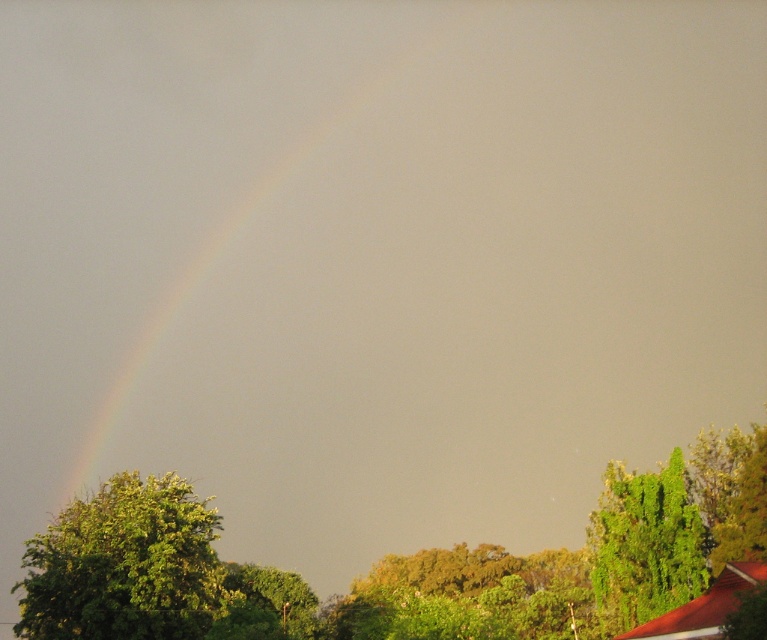
Question: Observing the image, what is the correct spatial positioning of rainbow at upper left in reference to green leafy tree at lower left?

Choices:
 (A) above
 (B) below

Answer: (A)

Question: Which point is closer to the camera taking this photo?

Choices:
 (A) (657, 502)
 (B) (203, 547)
 (C) (314, 627)

Answer: (A)

Question: Which of the following is the farthest from the observer?

Choices:
 (A) green leafy tree at lower left
 (B) rainbow at upper left

Answer: (B)

Question: Among these objects, which one is nearest to the camera?

Choices:
 (A) green leafy tree at lower left
 (B) rainbow at upper left
 (C) green leafy tree at right

Answer: (C)

Question: Where is green leafy tree at lower left located in relation to green leafy tree at right in the image?

Choices:
 (A) right
 (B) left

Answer: (B)

Question: In this image, where is green leafy tree at lower left located relative to green leafy tree at center?

Choices:
 (A) below
 (B) above

Answer: (B)